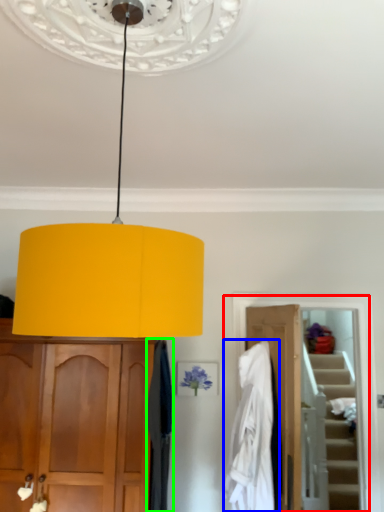
Question: Which object is positioned closest to closet (highlighted by a red box)? Select from clothing (highlighted by a blue box) and curtain (highlighted by a green box).

Choices:
 (A) clothing
 (B) curtain

Answer: (A)